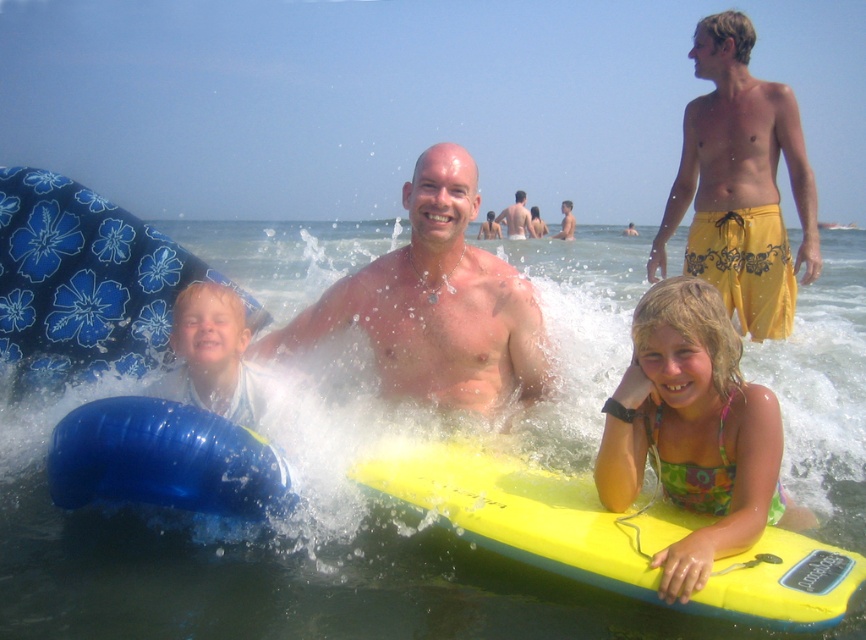
Question: Is yellow foam surfboard at center to the left of smooth tan skin at center from the viewer's perspective?

Choices:
 (A) no
 (B) yes

Answer: (B)

Question: Which point is closer to the camera?

Choices:
 (A) (789, 356)
 (B) (509, 205)
 (C) (572, 209)

Answer: (A)

Question: Is yellow foam board at center in front of yellow cotton shorts at upper right?

Choices:
 (A) yes
 (B) no

Answer: (A)

Question: Which object appears farthest from the camera in this image?

Choices:
 (A) yellow cotton shorts at upper right
 (B) smooth blue float at left
 (C) smooth tan skin at center

Answer: (C)

Question: Is multicolored fabric bikini at lower right above yellow cotton shorts at upper right?

Choices:
 (A) no
 (B) yes

Answer: (A)

Question: Which object is the closest to the yellow foam surfboard at center?

Choices:
 (A) smooth tan skin at center
 (B) multicolored fabric bikini at lower right

Answer: (B)